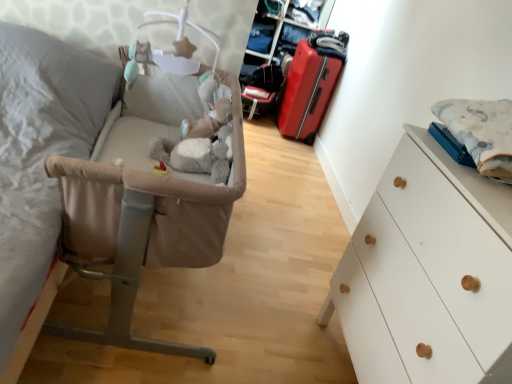
Question: From the image's perspective, is beige fabric infant bed at left above fluffy white blanket at right?

Choices:
 (A) no
 (B) yes

Answer: (A)

Question: Is beige fabric infant bed at left facing towards fluffy white blanket at right?

Choices:
 (A) yes
 (B) no

Answer: (B)

Question: Considering the relative sizes of beige fabric infant bed at left and fluffy white blanket at right in the image provided, is beige fabric infant bed at left taller than fluffy white blanket at right?

Choices:
 (A) yes
 (B) no

Answer: (A)

Question: Does beige fabric infant bed at left appear on the left side of fluffy white blanket at right?

Choices:
 (A) no
 (B) yes

Answer: (B)

Question: Can you confirm if beige fabric infant bed at left is bigger than fluffy white blanket at right?

Choices:
 (A) yes
 (B) no

Answer: (A)

Question: From a real-world perspective, is matte red suitcase at center-right physically located above or below white matte chest of drawers at right?

Choices:
 (A) above
 (B) below

Answer: (B)

Question: Considering the positions of point [x=293, y=109] and point [x=506, y=288], is point [x=293, y=109] closer or farther from the camera than point [x=506, y=288]?

Choices:
 (A) closer
 (B) farther

Answer: (B)

Question: Which is correct: matte red suitcase at center-right is inside white matte chest of drawers at right, or outside of it?

Choices:
 (A) inside
 (B) outside

Answer: (B)

Question: Looking at the image, does matte red suitcase at center-right seem bigger or smaller compared to white matte chest of drawers at right?

Choices:
 (A) small
 (B) big

Answer: (A)

Question: Visually, is beige fabric infant bed at left positioned to the left or to the right of matte red suitcase at center-right?

Choices:
 (A) left
 (B) right

Answer: (A)

Question: From the image's perspective, is beige fabric infant bed at left above or below matte red suitcase at center-right?

Choices:
 (A) above
 (B) below

Answer: (B)

Question: In terms of height, does beige fabric infant bed at left look taller or shorter compared to matte red suitcase at center-right?

Choices:
 (A) short
 (B) tall

Answer: (B)

Question: Relative to matte red suitcase at center-right, is beige fabric infant bed at left in front or behind?

Choices:
 (A) front
 (B) behind

Answer: (A)

Question: Considering the positions of fluffy white blanket at right and beige fabric infant bed at left in the image, is fluffy white blanket at right taller or shorter than beige fabric infant bed at left?

Choices:
 (A) short
 (B) tall

Answer: (A)

Question: From the image's perspective, is fluffy white blanket at right positioned above or below beige fabric infant bed at left?

Choices:
 (A) below
 (B) above

Answer: (B)